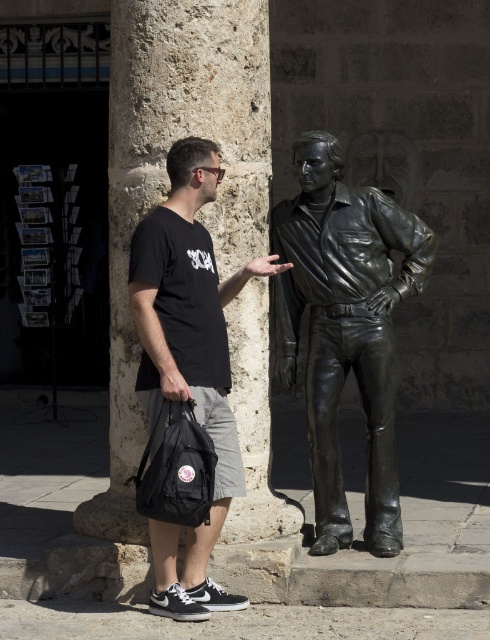
Question: Does bronze statue at center appear under black matte t-shirt at center?

Choices:
 (A) yes
 (B) no

Answer: (B)

Question: Which object is closer to the camera taking this photo?

Choices:
 (A) bronze statue at center
 (B) black matte t-shirt at center

Answer: (B)

Question: From the image, what is the correct spatial relationship of bronze statue at center in relation to black matte t-shirt at center?

Choices:
 (A) below
 (B) above

Answer: (B)

Question: Which point appears farthest from the camera in this image?

Choices:
 (A) (148, 300)
 (B) (324, 524)

Answer: (B)

Question: Can you confirm if bronze statue at center is thinner than black matte t-shirt at center?

Choices:
 (A) yes
 (B) no

Answer: (B)